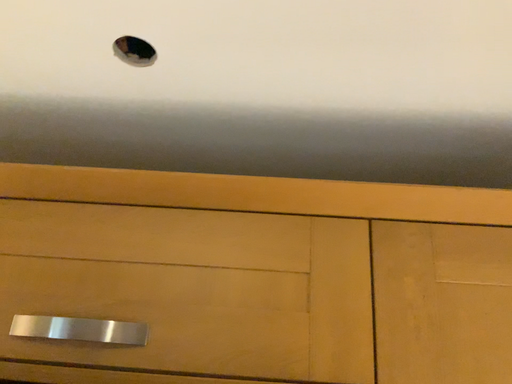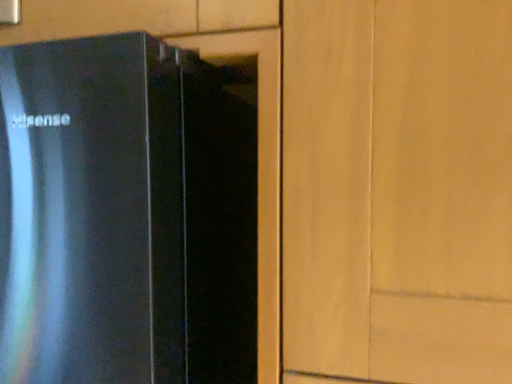
Question: How did the camera likely rotate when shooting the video?

Choices:
 (A) rotated upward
 (B) rotated downward

Answer: (B)